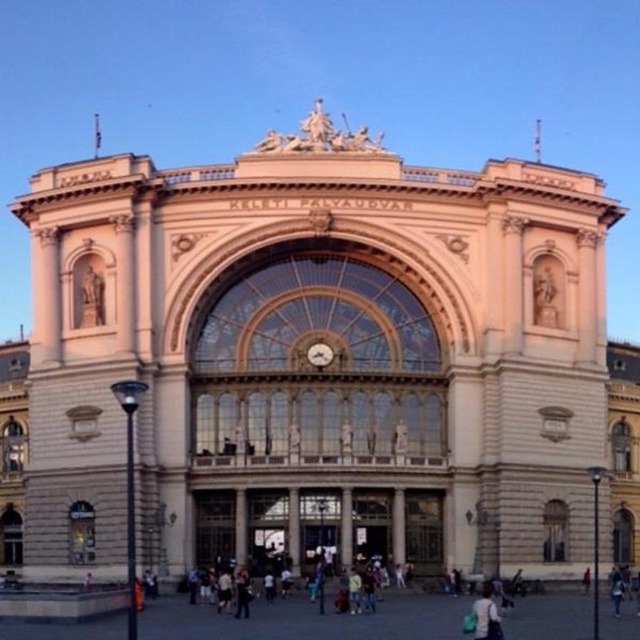
Question: Estimate the real-world distances between objects in this image. Which object is closer to the gold metallic clock at center?

Choices:
 (A) light blue fabric bag at lower center
 (B) beige stone pillar at center

Answer: (B)

Question: Considering the real-world distances, which object is closest to the light blue fabric bag at lower center?

Choices:
 (A) beige stone pillar at center
 (B) gold metallic clock at center

Answer: (A)

Question: Can you confirm if beige stone pillar at center is positioned to the left of gold metallic clock at center?

Choices:
 (A) yes
 (B) no

Answer: (B)

Question: Which of the following is the farthest from the observer?

Choices:
 (A) (324, 348)
 (B) (349, 513)

Answer: (A)

Question: From the image, what is the correct spatial relationship of light blue fabric bag at lower center in relation to gold metallic clock at center?

Choices:
 (A) below
 (B) above

Answer: (A)

Question: Does light blue fabric bag at lower center appear on the left side of beige stone pillar at center?

Choices:
 (A) no
 (B) yes

Answer: (A)